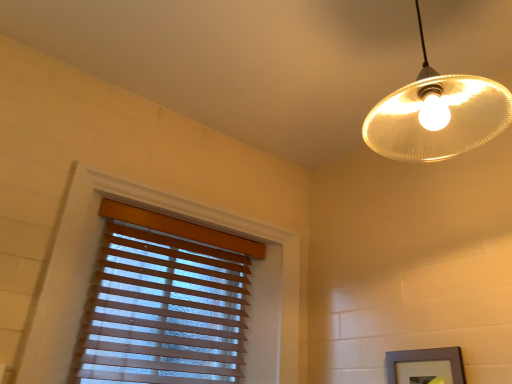
The width and height of the screenshot is (512, 384). What do you see at coordinates (437, 115) in the screenshot?
I see `translucent glass lampshade at upper right` at bounding box center [437, 115].

Locate an element on the screen. translucent glass lampshade at upper right is located at coordinates (437, 115).

Looking at the image, does wooden blinds at left seem bigger or smaller compared to translucent glass lampshade at upper right?

In the image, wooden blinds at left appears to be larger than translucent glass lampshade at upper right.

Does wooden blinds at left have a greater width compared to translucent glass lampshade at upper right?

In fact, wooden blinds at left might be narrower than translucent glass lampshade at upper right.

Does point (194, 335) lie behind point (375, 132)?

That is True.

Considering their positions, is wooden blinds at left located in front of or behind translucent glass lampshade at upper right?

wooden blinds at left is positioned farther from the viewer than translucent glass lampshade at upper right.

In terms of size, does gray matte picture frame at lower right appear bigger or smaller than wooden blinds at left?

In the image, gray matte picture frame at lower right appears to be smaller than wooden blinds at left.

Relative to wooden blinds at left, is gray matte picture frame at lower right in front or behind?

Visually, gray matte picture frame at lower right is located in front of wooden blinds at left.

Is gray matte picture frame at lower right positioned with its back to wooden blinds at left?

No, gray matte picture frame at lower right is not facing away from wooden blinds at left.

Looking at this image, what's the angular difference between gray matte picture frame at lower right and wooden blinds at left's facing directions?

They differ by 89.7 degrees in their facing directions.

Is wooden blinds at left taller than gray matte picture frame at lower right?

Indeed, wooden blinds at left has a greater height compared to gray matte picture frame at lower right.

Find the location of `picture frame that is below the wooden blinds at left (from the image's perspective)`. picture frame that is below the wooden blinds at left (from the image's perspective) is located at coordinates (426, 361).

In terms of width, does wooden blinds at left look wider or thinner when compared to gray matte picture frame at lower right?

wooden blinds at left is wider than gray matte picture frame at lower right.

Does gray matte picture frame at lower right lie in front of translucent glass lampshade at upper right?

No, gray matte picture frame at lower right is further to the viewer.

Is gray matte picture frame at lower right looking in the opposite direction of translucent glass lampshade at upper right?

That's not correct — gray matte picture frame at lower right is not looking away from translucent glass lampshade at upper right.

Is gray matte picture frame at lower right not within translucent glass lampshade at upper right?

gray matte picture frame at lower right is positioned outside translucent glass lampshade at upper right.

Is gray matte picture frame at lower right bigger or smaller than translucent glass lampshade at upper right?

Clearly, gray matte picture frame at lower right is smaller in size than translucent glass lampshade at upper right.

Considering the positions of objects translucent glass lampshade at upper right and gray matte picture frame at lower right in the image provided, who is more to the left, translucent glass lampshade at upper right or gray matte picture frame at lower right?

translucent glass lampshade at upper right.

Can you confirm if translucent glass lampshade at upper right is wider than gray matte picture frame at lower right?

Indeed, translucent glass lampshade at upper right has a greater width compared to gray matte picture frame at lower right.

Based on the photo, considering the sizes of translucent glass lampshade at upper right and gray matte picture frame at lower right in the image, is translucent glass lampshade at upper right bigger or smaller than gray matte picture frame at lower right?

Considering their sizes, translucent glass lampshade at upper right takes up more space than gray matte picture frame at lower right.

This screenshot has width=512, height=384. In order to click on picture frame behind the translucent glass lampshade at upper right in this screenshot , I will do `click(426, 361)`.

Based on their positions, is translucent glass lampshade at upper right located to the left or right of wooden blinds at left?

Based on their positions, translucent glass lampshade at upper right is located to the right of wooden blinds at left.

From the image's perspective, is translucent glass lampshade at upper right under wooden blinds at left?

→ No, from the image's perspective, translucent glass lampshade at upper right is not beneath wooden blinds at left.

Considering the relative sizes of translucent glass lampshade at upper right and wooden blinds at left in the image provided, is translucent glass lampshade at upper right thinner than wooden blinds at left?

In fact, translucent glass lampshade at upper right might be wider than wooden blinds at left.

Is there a large distance between translucent glass lampshade at upper right and wooden blinds at left?

They are positioned close to each other.

In order to click on window blind lying behind the translucent glass lampshade at upper right in this screenshot , I will do `click(165, 302)`.

Locate an element on the screen. This screenshot has width=512, height=384. picture frame to the right of wooden blinds at left is located at coordinates (426, 361).

From the image, which object appears to be farther from translucent glass lampshade at upper right, wooden blinds at left or gray matte picture frame at lower right?

The object further to translucent glass lampshade at upper right is wooden blinds at left.

Looking at the image, which one is located further to wooden blinds at left, translucent glass lampshade at upper right or gray matte picture frame at lower right?

Among the two, translucent glass lampshade at upper right is located further to wooden blinds at left.

Based on the photo, based on their spatial positions, is gray matte picture frame at lower right or wooden blinds at left further from translucent glass lampshade at upper right?

Based on the image, wooden blinds at left appears to be further to translucent glass lampshade at upper right.

Estimate the real-world distances between objects in this image. Which object is closer to gray matte picture frame at lower right, wooden blinds at left or translucent glass lampshade at upper right?

Based on the image, translucent glass lampshade at upper right appears to be nearer to gray matte picture frame at lower right.

Looking at the image, which one is located further to gray matte picture frame at lower right, translucent glass lampshade at upper right or wooden blinds at left?

wooden blinds at left lies further to gray matte picture frame at lower right than the other object.

Looking at the image, which one is located further to wooden blinds at left, gray matte picture frame at lower right or translucent glass lampshade at upper right?

translucent glass lampshade at upper right.

Locate an element on the screen. window blind between translucent glass lampshade at upper right and gray matte picture frame at lower right from top to bottom is located at coordinates (165, 302).